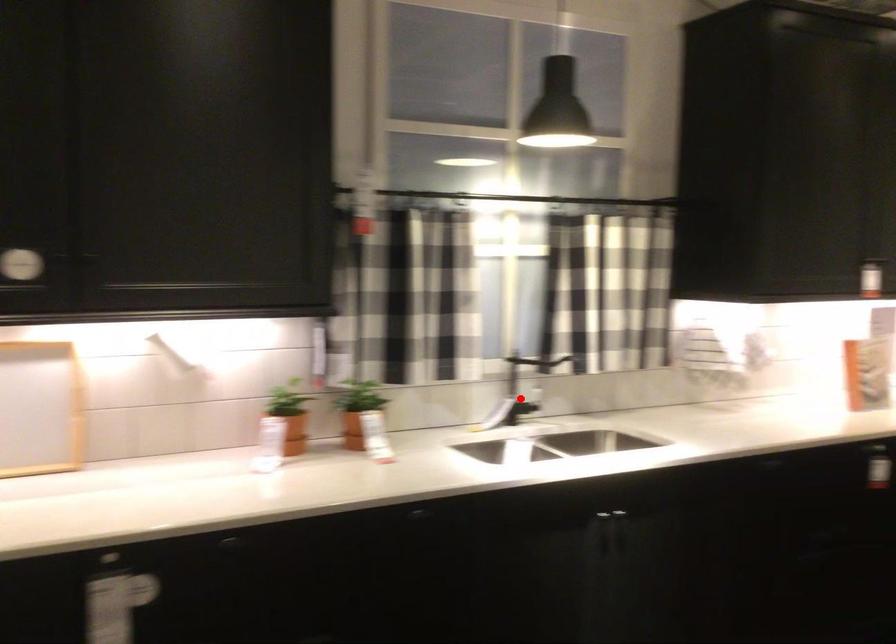
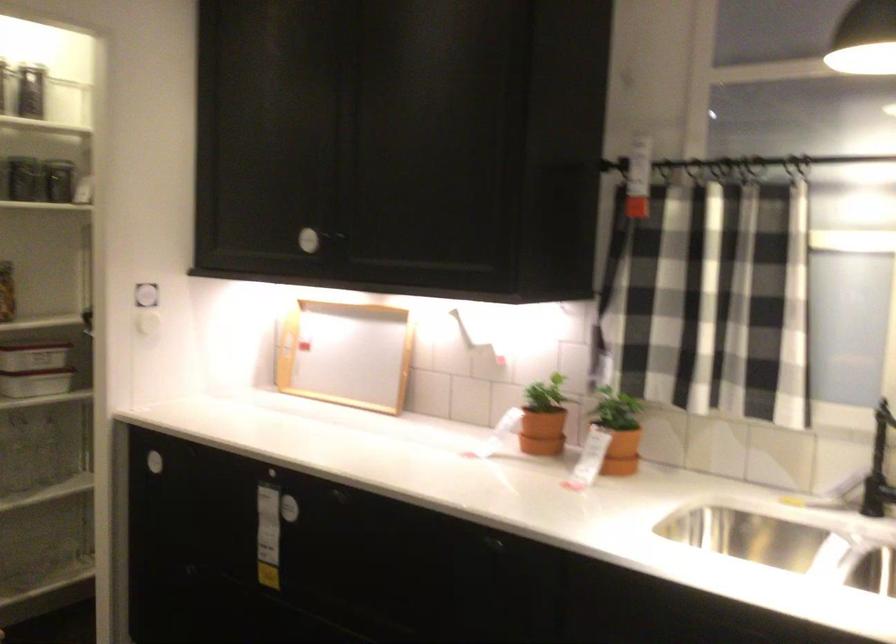
Question: I am providing you with two images of the same scene from different viewpoints. Given a red point in image1, look at the same physical point in image2. Is it:

Choices:
 (A) Closer to the viewpoint
 (B) Farther from the viewpoint

Answer: (A)